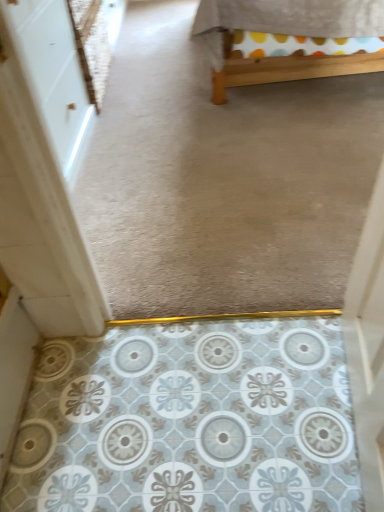
Question: Considering the relative sizes of white glossy door at left and wooden bed frame at upper center in the image provided, is white glossy door at left bigger than wooden bed frame at upper center?

Choices:
 (A) yes
 (B) no

Answer: (B)

Question: Is white glossy door at left looking in the opposite direction of wooden bed frame at upper center?

Choices:
 (A) no
 (B) yes

Answer: (A)

Question: Does white glossy door at left appear on the left side of wooden bed frame at upper center?

Choices:
 (A) yes
 (B) no

Answer: (A)

Question: Can you confirm if white glossy door at left is thinner than wooden bed frame at upper center?

Choices:
 (A) no
 (B) yes

Answer: (B)

Question: Can you confirm if white glossy door at left is smaller than wooden bed frame at upper center?

Choices:
 (A) yes
 (B) no

Answer: (A)

Question: Does white glossy door at left have a greater width compared to wooden bed frame at upper center?

Choices:
 (A) no
 (B) yes

Answer: (A)

Question: Considering the relative sizes of wooden bed frame at upper center and white glossy door at left in the image provided, is wooden bed frame at upper center smaller than white glossy door at left?

Choices:
 (A) yes
 (B) no

Answer: (B)

Question: Is there a large distance between wooden bed frame at upper center and white glossy door at left?

Choices:
 (A) no
 (B) yes

Answer: (A)

Question: Is wooden bed frame at upper center thinner than white glossy door at left?

Choices:
 (A) no
 (B) yes

Answer: (A)

Question: Is wooden bed frame at upper center in contact with white glossy door at left?

Choices:
 (A) no
 (B) yes

Answer: (A)

Question: From the image's perspective, is wooden bed frame at upper center beneath white glossy door at left?

Choices:
 (A) no
 (B) yes

Answer: (A)

Question: Is wooden bed frame at upper center facing towards white glossy door at left?

Choices:
 (A) yes
 (B) no

Answer: (A)

Question: From the image's perspective, is white glossy door at left located above or below wooden bed frame at upper center?

Choices:
 (A) above
 (B) below

Answer: (B)